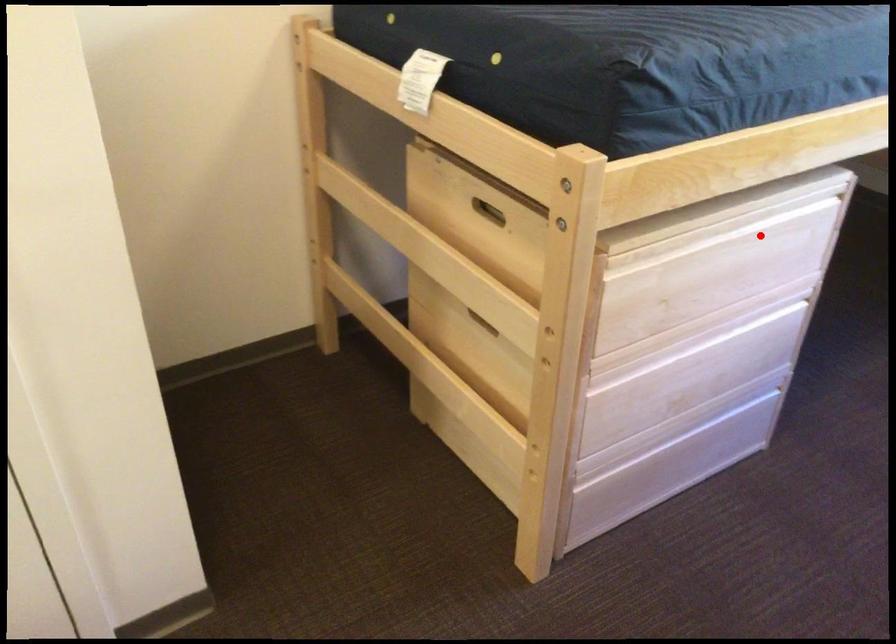
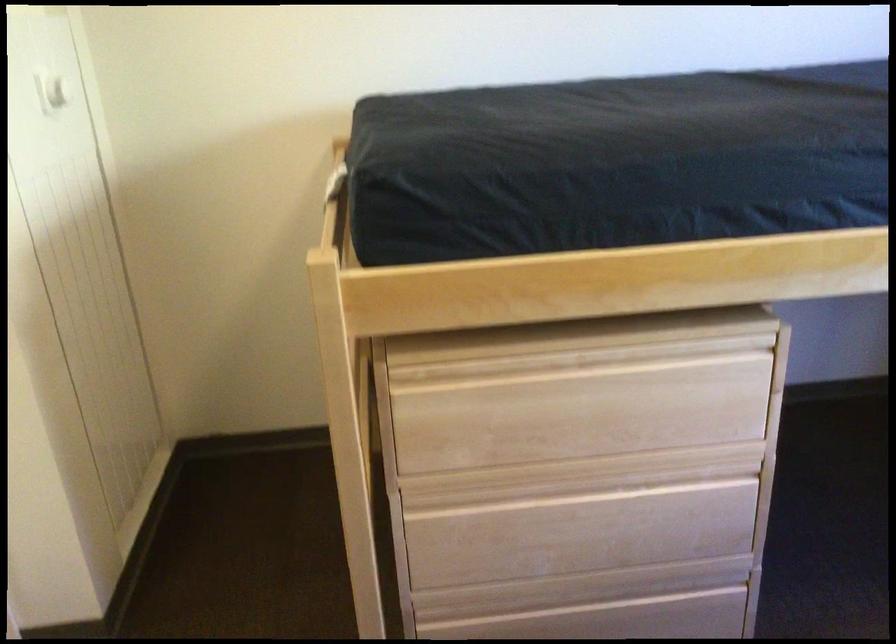
Question: I am providing you with two images of the same scene from different viewpoints. Image1 has a red point marked. In image2, the corresponding 3D location appears at what relative position? Reply with the corresponding letter.

Choices:
 (A) Closer
 (B) Farther

Answer: (A)